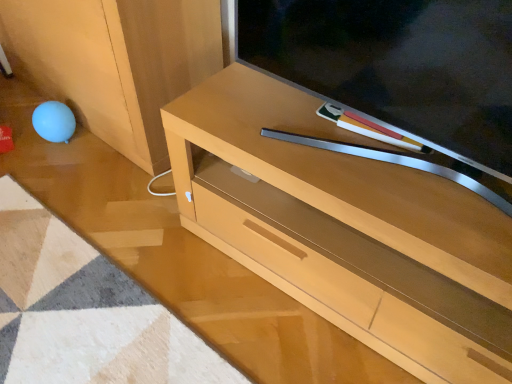
Question: Is the position of light wood cabinet at lower right more distant than that of matte wood television at center?

Choices:
 (A) no
 (B) yes

Answer: (B)

Question: Is light wood cabinet at lower right wider than matte wood television at center?

Choices:
 (A) yes
 (B) no

Answer: (A)

Question: Is light wood cabinet at lower right looking in the opposite direction of matte wood television at center?

Choices:
 (A) yes
 (B) no

Answer: (B)

Question: Could matte wood television at center be considered to be inside light wood cabinet at lower right?

Choices:
 (A) yes
 (B) no

Answer: (B)

Question: Does light wood cabinet at lower right have a greater height compared to matte wood television at center?

Choices:
 (A) no
 (B) yes

Answer: (B)

Question: From the image's perspective, does light wood cabinet at lower right appear lower than matte wood television at center?

Choices:
 (A) no
 (B) yes

Answer: (A)

Question: From the image's perspective, is light wood cabinet at lower right beneath light brown wood tv stand at center?

Choices:
 (A) no
 (B) yes

Answer: (A)

Question: Considering the relative sizes of light wood cabinet at lower right and light brown wood tv stand at center in the image provided, is light wood cabinet at lower right taller than light brown wood tv stand at center?

Choices:
 (A) no
 (B) yes

Answer: (B)

Question: From a real-world perspective, is light wood cabinet at lower right located higher than light brown wood tv stand at center?

Choices:
 (A) no
 (B) yes

Answer: (B)

Question: Can we say light wood cabinet at lower right lies outside light brown wood tv stand at center?

Choices:
 (A) yes
 (B) no

Answer: (A)

Question: Considering the relative positions of light wood cabinet at lower right and light brown wood tv stand at center in the image provided, is light wood cabinet at lower right in front of light brown wood tv stand at center?

Choices:
 (A) yes
 (B) no

Answer: (B)

Question: Is the depth of light wood cabinet at lower right greater than that of light brown wood tv stand at center?

Choices:
 (A) yes
 (B) no

Answer: (A)

Question: Is matte wood television at center taller than light brown wood tv stand at center?

Choices:
 (A) no
 (B) yes

Answer: (A)